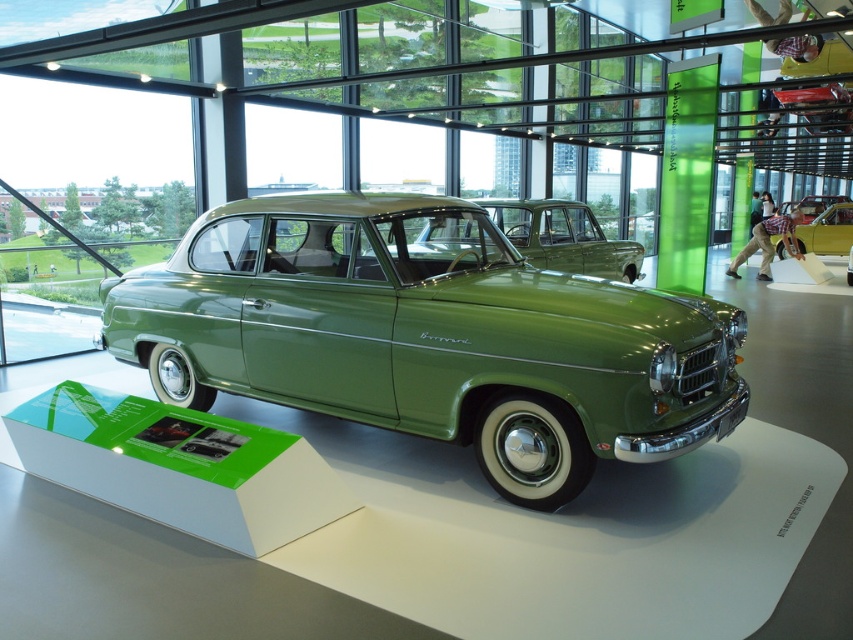
Does green matte sedan at center lie behind metallic gold car at center?

No, green matte sedan at center is in front of metallic gold car at center.

Is green matte sedan at center shorter than metallic gold car at center?

Yes.

The height and width of the screenshot is (640, 853). Identify the location of green matte sedan at center. (563, 237).

Which of these two, green matte car at center or green matte sedan at center, stands shorter?

With less height is green matte sedan at center.

Can you confirm if green matte car at center is bigger than green matte sedan at center?

Indeed, green matte car at center has a larger size compared to green matte sedan at center.

This screenshot has height=640, width=853. In order to click on green matte car at center in this screenshot , I will do `click(428, 337)`.

Does green matte car at center have a smaller size compared to metallic gold car at center?

Incorrect, green matte car at center is not smaller in size than metallic gold car at center.

Is point (515, 273) less distant than point (805, 236)?

Yes, point (515, 273) is closer to viewer.

The image size is (853, 640). In order to click on green matte car at center in this screenshot , I will do click(428, 337).